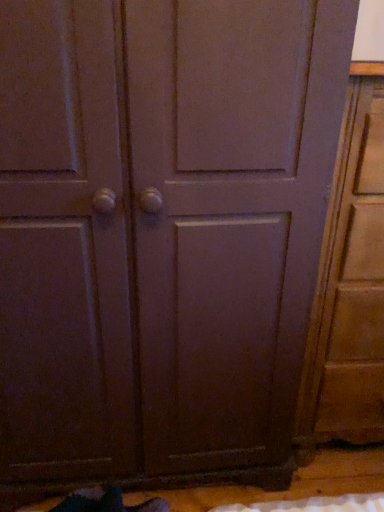
This screenshot has width=384, height=512. What do you see at coordinates (350, 283) in the screenshot?
I see `wooden door at right` at bounding box center [350, 283].

Locate an element on the screen. Image resolution: width=384 pixels, height=512 pixels. wooden door at right is located at coordinates (350, 283).

Where is `wooden door at right`? The width and height of the screenshot is (384, 512). wooden door at right is located at coordinates (350, 283).